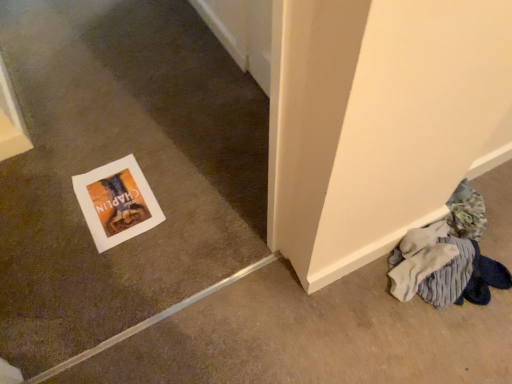
Question: Should I look upward or downward to see matte paper postcard at lower left?

Choices:
 (A) up
 (B) down

Answer: (B)